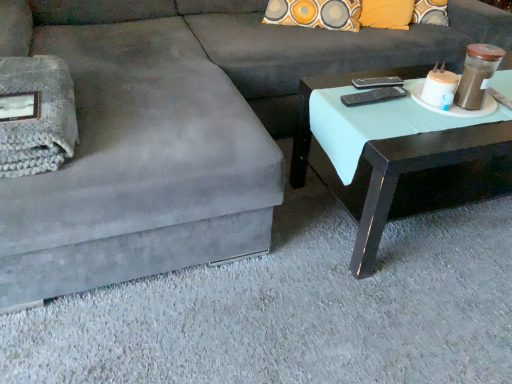
Question: From a real-world perspective, relative to matte black coffee table at right, is black plastic remote at upper right, the 1th remote from the bottom, vertically above or below?

Choices:
 (A) above
 (B) below

Answer: (A)

Question: Considering the positions of black plastic remote at upper right, the 2th remote viewed from the back, and matte black coffee table at right in the image, is black plastic remote at upper right, the 2th remote viewed from the back, wider or thinner than matte black coffee table at right?

Choices:
 (A) thin
 (B) wide

Answer: (A)

Question: Which object is the closest to the black plastic remote at upper right, the 1th remote in the front-to-back sequence?

Choices:
 (A) black plastic remote at upper right, which is the second remote in front-to-back order
 (B) matte black coffee table at right

Answer: (A)

Question: Which is nearer to the black plastic remote at upper right, which ranks as the 2th remote in top-to-bottom order?

Choices:
 (A) matte black coffee table at right
 (B) black plastic remote at upper right, which appears as the 2th remote when ordered from the bottom

Answer: (B)